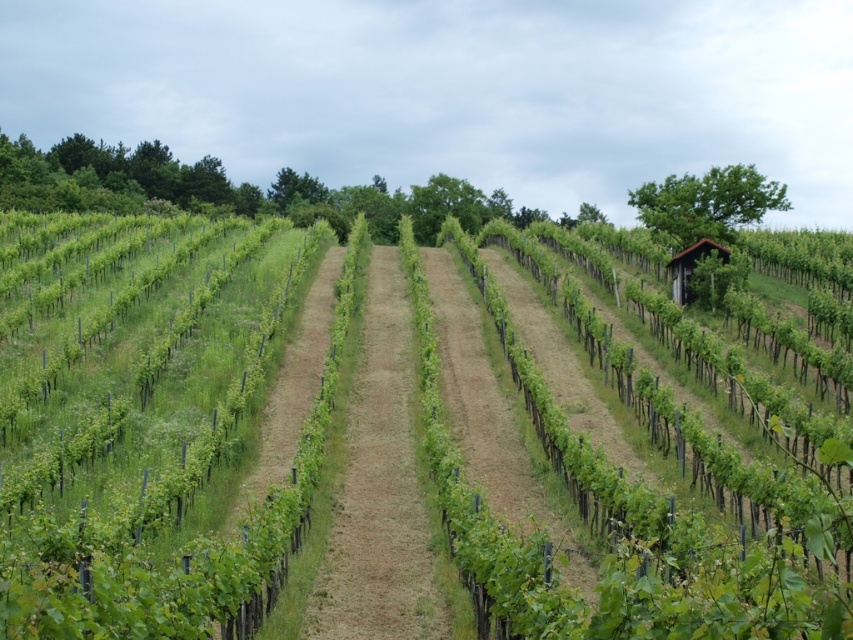
You are a gardener standing in the vineyard and notice both the green leafy vines at center and the green grass at center. Which one has a greater height?

The green leafy vines at center are taller than the green grass at center.

From the picture: You are a gardener looking at the vineyard. You see the green leafy vines at center and the green grass at center. Which one is above the other?

The green leafy vines at center are positioned over the green grass at center, so the vines are above the grass.